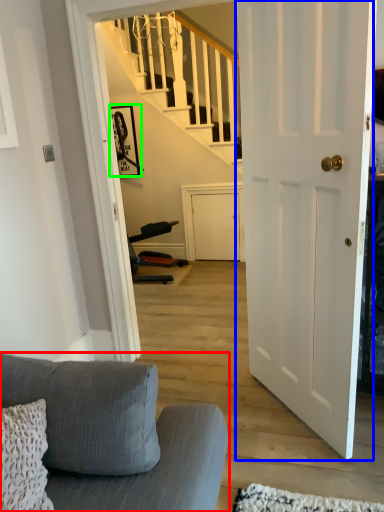
Question: Based on their relative distances, which object is farther from studio couch (highlighted by a red box)? Choose from door (highlighted by a blue box) and picture frame (highlighted by a green box).

Choices:
 (A) door
 (B) picture frame

Answer: (B)